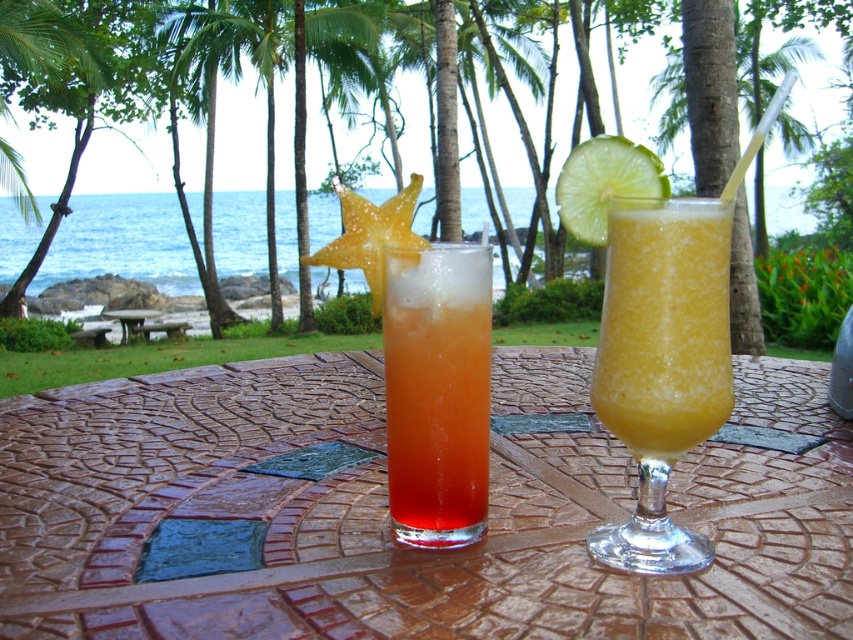
Question: Can you confirm if smooth yellow slushie at center is positioned to the right of brown textured table at center?

Choices:
 (A) yes
 (B) no

Answer: (A)

Question: Does translucent glass at center lie in front of green matte lime at upper right?

Choices:
 (A) no
 (B) yes

Answer: (B)

Question: Is translucent glass at center below yellow frosted glass at right?

Choices:
 (A) yes
 (B) no

Answer: (A)

Question: Considering the real-world distances, which object is farthest from the yellow frosted glass at right?

Choices:
 (A) translucent glass at center
 (B) translucent orange drink at center

Answer: (A)

Question: Among these points, which one is farthest from the camera?

Choices:
 (A) (440, 472)
 (B) (622, 547)
 (C) (463, 289)
 (D) (604, 333)

Answer: (A)

Question: Which point is closer to the camera taking this photo?

Choices:
 (A) (115, 308)
 (B) (410, 460)
 (C) (634, 436)

Answer: (C)